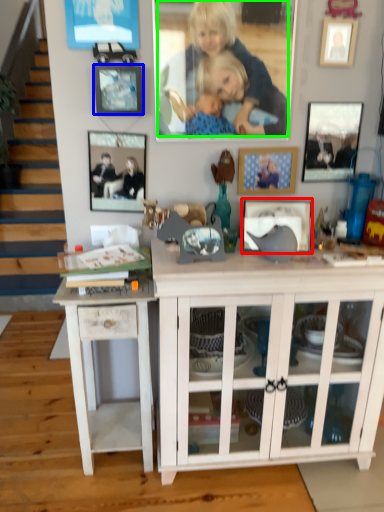
Question: Which is nearer to the picture frame (highlighted by a red box)? picture frame (highlighted by a blue box) or person (highlighted by a green box).

Choices:
 (A) picture frame
 (B) person

Answer: (B)